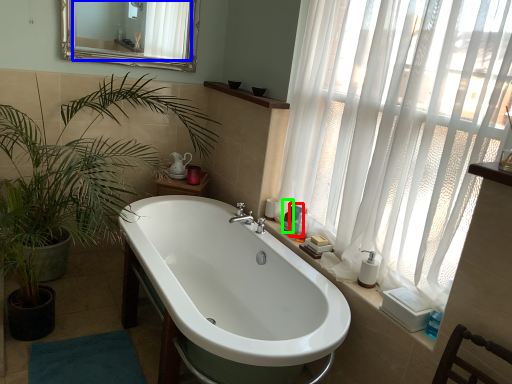
Question: Which object is the closest to the toiletry (highlighted by a red box)? Choose among these: mirror (highlighted by a blue box) or toiletry (highlighted by a green box).

Choices:
 (A) mirror
 (B) toiletry

Answer: (B)